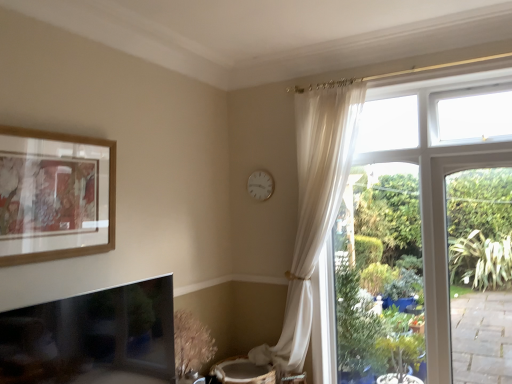
Question: From a real-world perspective, is white plastic clock at upper center positioned above or below wooden picture frame at upper left?

Choices:
 (A) above
 (B) below

Answer: (A)

Question: Would you say white plastic clock at upper center is inside or outside wooden picture frame at upper left?

Choices:
 (A) outside
 (B) inside

Answer: (A)

Question: From the image's perspective, is white plastic clock at upper center positioned above or below wooden picture frame at upper left?

Choices:
 (A) below
 (B) above

Answer: (B)

Question: Is wooden picture frame at upper left bigger or smaller than white plastic clock at upper center?

Choices:
 (A) small
 (B) big

Answer: (B)

Question: In terms of height, does wooden picture frame at upper left look taller or shorter compared to white plastic clock at upper center?

Choices:
 (A) short
 (B) tall

Answer: (B)

Question: Is wooden picture frame at upper left situated inside white plastic clock at upper center or outside?

Choices:
 (A) outside
 (B) inside

Answer: (A)

Question: From a real-world perspective, is wooden picture frame at upper left positioned above or below white plastic clock at upper center?

Choices:
 (A) above
 (B) below

Answer: (B)